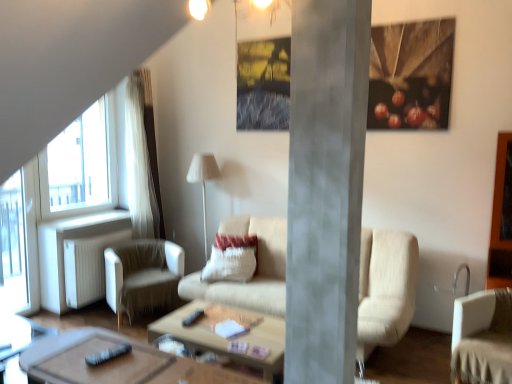
Question: Can you confirm if transparent glass window at left is smaller than white fabric chair at lower right, the first chair in the front-to-back sequence?

Choices:
 (A) no
 (B) yes

Answer: (B)

Question: Can you confirm if transparent glass window at left is positioned to the right of white fabric chair at lower right, the first chair in the front-to-back sequence?

Choices:
 (A) no
 (B) yes

Answer: (A)

Question: Does transparent glass window at left have a lesser width compared to white fabric chair at lower right, arranged as the first chair when viewed from the right?

Choices:
 (A) no
 (B) yes

Answer: (B)

Question: Would you say transparent glass window at left is outside white fabric chair at lower right, arranged as the first chair when viewed from the right?

Choices:
 (A) yes
 (B) no

Answer: (A)

Question: Is transparent glass window at left to the left of white fabric chair at lower right, which appears as the second chair when viewed from the left, from the viewer's perspective?

Choices:
 (A) no
 (B) yes

Answer: (B)

Question: From a real-world perspective, is wooden coffee table at center, the first coffee table from the back, physically located above or below transparent glass window at left?

Choices:
 (A) above
 (B) below

Answer: (B)

Question: Considering the positions of wooden coffee table at center, marked as the 2th coffee table in a front-to-back arrangement, and transparent glass window at left in the image, is wooden coffee table at center, marked as the 2th coffee table in a front-to-back arrangement, bigger or smaller than transparent glass window at left?

Choices:
 (A) big
 (B) small

Answer: (A)

Question: Looking at their shapes, would you say wooden coffee table at center, the first coffee table from the back, is wider or thinner than transparent glass window at left?

Choices:
 (A) thin
 (B) wide

Answer: (B)

Question: From the image's perspective, is wooden coffee table at center, marked as the 2th coffee table in a front-to-back arrangement, positioned above or below transparent glass window at left?

Choices:
 (A) below
 (B) above

Answer: (A)

Question: Choose the correct answer: Is matte white light fixture at upper center inside transparent glass window at left or outside it?

Choices:
 (A) outside
 (B) inside

Answer: (A)

Question: From a real-world perspective, relative to transparent glass window at left, is matte white light fixture at upper center vertically above or below?

Choices:
 (A) below
 (B) above

Answer: (B)

Question: Considering the positions of matte white light fixture at upper center and transparent glass window at left in the image, is matte white light fixture at upper center taller or shorter than transparent glass window at left?

Choices:
 (A) short
 (B) tall

Answer: (A)

Question: Considering the positions of matte white light fixture at upper center and transparent glass window at left in the image, is matte white light fixture at upper center wider or thinner than transparent glass window at left?

Choices:
 (A) thin
 (B) wide

Answer: (B)

Question: Would you say white textured pillow at center is to the left or to the right of white fabric lamp at center in the picture?

Choices:
 (A) left
 (B) right

Answer: (B)

Question: From the image's perspective, is white textured pillow at center above or below white fabric lamp at center?

Choices:
 (A) above
 (B) below

Answer: (B)